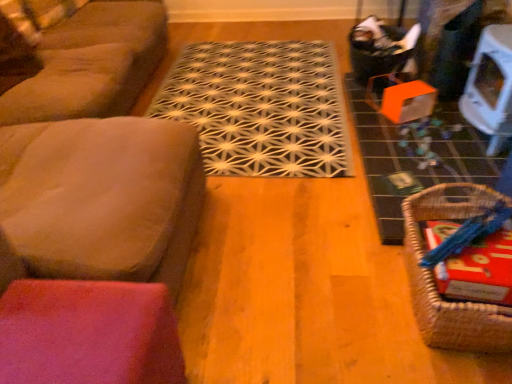
You are a GUI agent. You are given a task and a screenshot of the screen. Output one action in this format:
    pyautogui.click(x=<x>, y=<y>)
    Task: Click on the white glossy table at upper right
    Image resolution: width=512 pixels, height=384 pixels.
    Given the screenshot: What is the action you would take?
    pyautogui.click(x=490, y=87)

The width and height of the screenshot is (512, 384). What are the coordinates of `white glossy table at upper right` in the screenshot? It's located at (490, 87).

Between white glossy table at upper right and suede-like brown couch at left, which one is positioned behind?

white glossy table at upper right is more distant.

In terms of height, does white glossy table at upper right look taller or shorter compared to suede-like brown couch at left?

white glossy table at upper right is shorter than suede-like brown couch at left.

The width and height of the screenshot is (512, 384). I want to click on studio couch in front of the white glossy table at upper right, so click(x=91, y=63).

Considering the points (503, 50) and (71, 32), which point is in front, point (503, 50) or point (71, 32)?

Point (503, 50)

Is suede-like brown couch at left aimed at suede-like brown couch at left?

No, suede-like brown couch at left is not facing towards suede-like brown couch at left.

Image resolution: width=512 pixels, height=384 pixels. In the image, there is a suede-like brown couch at left. What are the coordinates of `studio couch below it (from a real-world perspective)` in the screenshot? It's located at (91, 63).

Can you confirm if suede-like brown couch at left is shorter than suede-like brown couch at left?

Yes.

Which of these two, suede-like brown couch at left or suede-like brown couch at left, is bigger?

With larger size is suede-like brown couch at left.

Consider the image. Considering the sizes of objects suede-like brown couch at left and black woven mat at center in the image provided, who is smaller, suede-like brown couch at left or black woven mat at center?

Smaller between the two is black woven mat at center.

Can you confirm if suede-like brown couch at left is wider than black woven mat at center?

No, suede-like brown couch at left is not wider than black woven mat at center.

Between point (83, 170) and point (272, 61), which one is positioned behind?

The point (272, 61) is farther from the camera.

In the scene shown: Is suede-like brown couch at left not close to black woven mat at center?

That's not correct — suede-like brown couch at left is a little close to black woven mat at center.

In the image, there is a suede-like brown couch at left. Where is `basket below it (from a real-world perspective)`? The height and width of the screenshot is (384, 512). basket below it (from a real-world perspective) is located at coordinates (435, 279).

Can you confirm if woven brown basket at lower right is bigger than suede-like brown couch at left?

Incorrect, woven brown basket at lower right is not larger than suede-like brown couch at left.

From the image's perspective, would you say woven brown basket at lower right is positioned over suede-like brown couch at left?

Incorrect, from the image's perspective, woven brown basket at lower right is lower than suede-like brown couch at left.

Would you consider woven brown basket at lower right to be distant from suede-like brown couch at left?

Yes, woven brown basket at lower right and suede-like brown couch at left are located far from each other.

Which of these two, black woven mat at center or white glossy table at upper right, is thinner?

white glossy table at upper right.

In the scene shown: Choose the correct answer: Is black woven mat at center inside white glossy table at upper right or outside it?

black woven mat at center is not inside white glossy table at upper right, it's outside.

From a real-world perspective, is black woven mat at center over white glossy table at upper right?

Incorrect, from a real-world perspective, black woven mat at center is lower than white glossy table at upper right.

Locate an element on the screen. The height and width of the screenshot is (384, 512). doormat that appears above the white glossy table at upper right (from the image's perspective) is located at coordinates (260, 107).

How much distance is there between suede-like brown couch at left and black woven mat at center?

The distance of suede-like brown couch at left from black woven mat at center is 24.57 inches.

Who is shorter, suede-like brown couch at left or black woven mat at center?

black woven mat at center is shorter.

How many degrees apart are the facing directions of suede-like brown couch at left and black woven mat at center?

The angular difference between suede-like brown couch at left and black woven mat at center is 89.3 degrees.

Is suede-like brown couch at left smaller than black woven mat at center?

No, suede-like brown couch at left is not smaller than black woven mat at center.

Consider the image. Between black woven mat at center and suede-like brown couch at left, which one has more height?

suede-like brown couch at left is taller.

Which object is thinner, black woven mat at center or suede-like brown couch at left?

suede-like brown couch at left.

Between point (159, 115) and point (12, 108), which one is positioned in front?

The point (12, 108) is more forward.

The width and height of the screenshot is (512, 384). I want to click on studio couch that appears on the left of white glossy table at upper right, so click(91, 63).

Where is `studio couch that appears behind the suede-like brown couch at left`? The image size is (512, 384). studio couch that appears behind the suede-like brown couch at left is located at coordinates (91, 63).

Estimate the real-world distances between objects in this image. Which object is further from suede-like brown couch at left, black woven mat at center or suede-like brown couch at left?

suede-like brown couch at left is further to suede-like brown couch at left.

When comparing their distances from white glossy table at upper right, does woven brown basket at lower right or black woven mat at center seem closer?

Among the two, woven brown basket at lower right is located nearer to white glossy table at upper right.

Estimate the real-world distances between objects in this image. Which object is closer to suede-like brown couch at left, white glossy table at upper right or black woven mat at center?

Among the two, black woven mat at center is located nearer to suede-like brown couch at left.

Considering their positions, is woven brown basket at lower right positioned closer to white glossy table at upper right than suede-like brown couch at left?

Among the two, woven brown basket at lower right is located nearer to white glossy table at upper right.

Which object lies further to the anchor point black woven mat at center, suede-like brown couch at left or suede-like brown couch at left?

Based on the image, suede-like brown couch at left appears to be further to black woven mat at center.

Considering their positions, is suede-like brown couch at left positioned closer to black woven mat at center than suede-like brown couch at left?

suede-like brown couch at left.

Based on their spatial positions, is white glossy table at upper right or suede-like brown couch at left closer to woven brown basket at lower right?

Among the two, white glossy table at upper right is located nearer to woven brown basket at lower right.

Considering their positions, is suede-like brown couch at left positioned closer to woven brown basket at lower right than white glossy table at upper right?

white glossy table at upper right lies closer to woven brown basket at lower right than the other object.

This screenshot has height=384, width=512. I want to click on doormat between suede-like brown couch at left and woven brown basket at lower right in the horizontal direction, so click(x=260, y=107).

Where is `doormat between suede-like brown couch at left and white glossy table at upper right in the horizontal direction`? The image size is (512, 384). doormat between suede-like brown couch at left and white glossy table at upper right in the horizontal direction is located at coordinates (260, 107).

Locate an element on the screen. Image resolution: width=512 pixels, height=384 pixels. studio couch between suede-like brown couch at left and black woven mat at center from front to back is located at coordinates (91, 63).

Find the location of a particular element. The image size is (512, 384). couch between suede-like brown couch at left and woven brown basket at lower right in the horizontal direction is located at coordinates (102, 198).